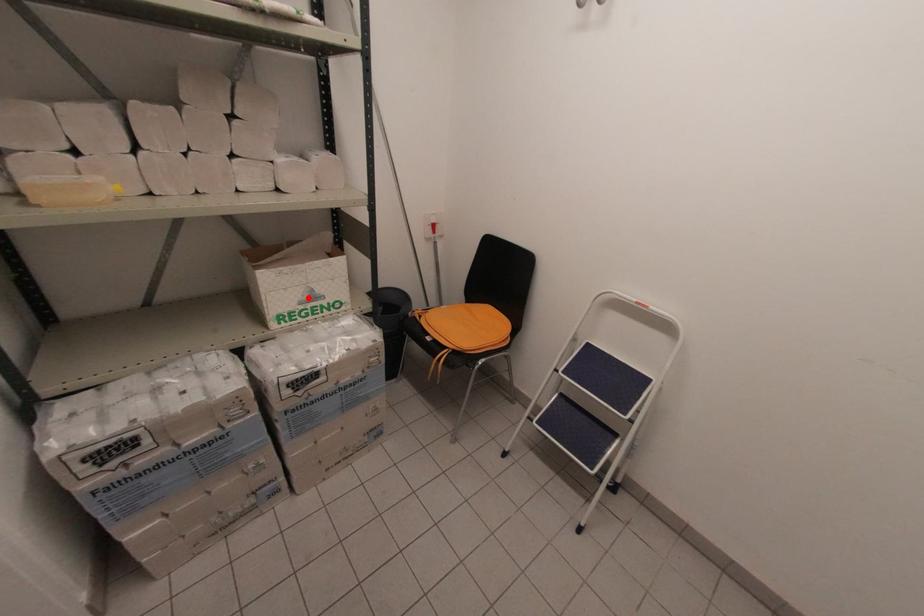
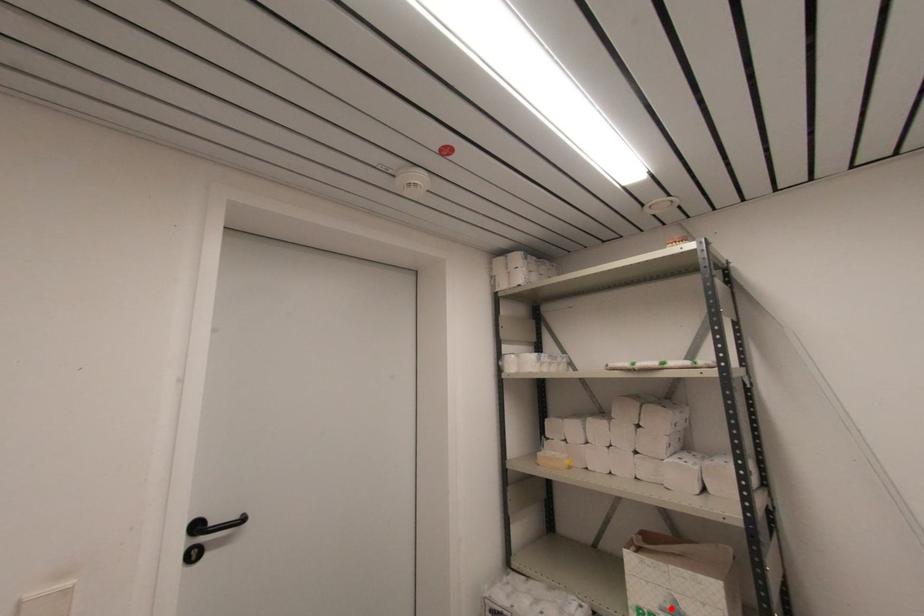
I am providing you with two images of the same scene from different viewpoints. A red point is marked on the first image and another point is marked on the second image. Do the highlighted points in image1 and image2 indicate the same real-world spot?

Yes